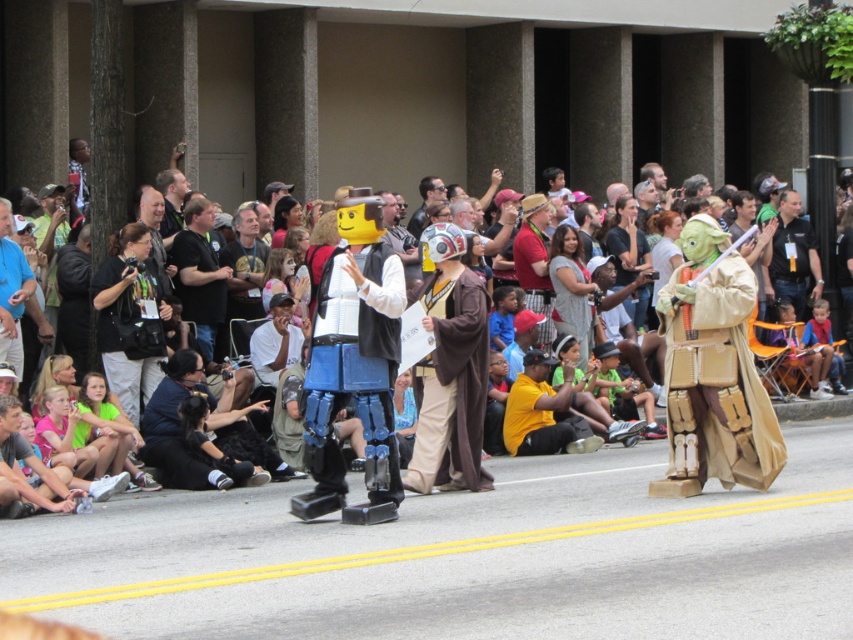
You are a photographer standing in the middle of the street. You want to take a photo of both the blue plastic robot at center and the black shirt at center. Which object will appear larger in the photo?

The blue plastic robot at center will appear larger in the photo because it is closer to the viewer than the black shirt at center.

You are standing at the parade and want to take a photo of both point [779,323] and point [430,179]. Which point should you focus on first to ensure both are in focus?

You should focus on point [779,323] first because it is closer to the camera than point [430,179], ensuring both points are within the depth of field.